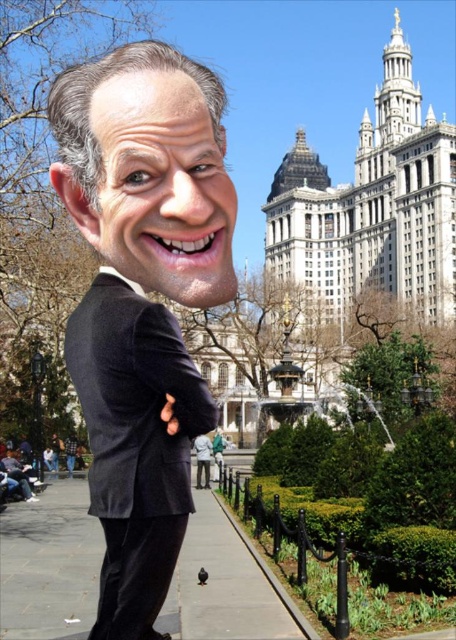
Question: Estimate the real-world distances between objects in this image. Which object is farther from the black velvet suit at left?

Choices:
 (A) black matte suit at center
 (B) matte black suit at center

Answer: (B)

Question: Does black matte suit at center appear under black velvet suit at left?

Choices:
 (A) no
 (B) yes

Answer: (A)

Question: Among these points, which one is farthest from the camera?

Choices:
 (A) (144, 545)
 (B) (129, 58)
 (C) (34, 492)

Answer: (C)

Question: Estimate the real-world distances between objects in this image. Which object is closer to the black matte suit at center?

Choices:
 (A) matte black suit at center
 (B) black velvet suit at left

Answer: (B)

Question: Can you confirm if black matte suit at center is positioned to the left of black velvet suit at left?

Choices:
 (A) no
 (B) yes

Answer: (B)

Question: Is black matte suit at center to the right of black velvet suit at left from the viewer's perspective?

Choices:
 (A) yes
 (B) no

Answer: (B)